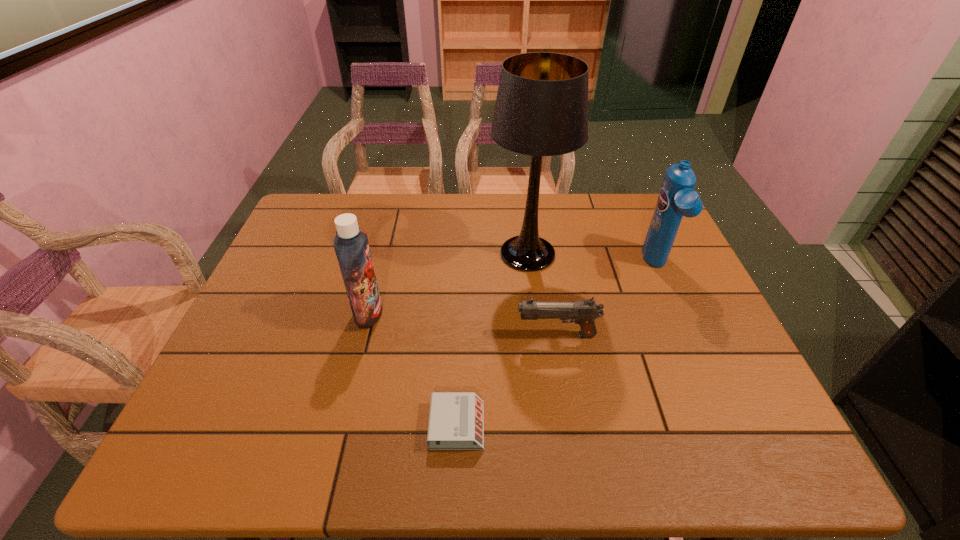
The image size is (960, 540). What are the coordinates of `free spot that satisfies the following two spatial constraints: 1. on the back side of the shortest object; 2. on the front label of the nearer shampoo` in the screenshot? It's located at (462, 313).

Where is `free spot that satisfies the following two spatial constraints: 1. on the front label of the nearer shampoo; 2. on the left side of the nearest object`? The height and width of the screenshot is (540, 960). free spot that satisfies the following two spatial constraints: 1. on the front label of the nearer shampoo; 2. on the left side of the nearest object is located at coordinates (341, 425).

The width and height of the screenshot is (960, 540). I want to click on vacant space that satisfies the following two spatial constraints: 1. on the front label of the nearer shampoo; 2. on the back side of the shortest object, so click(x=341, y=425).